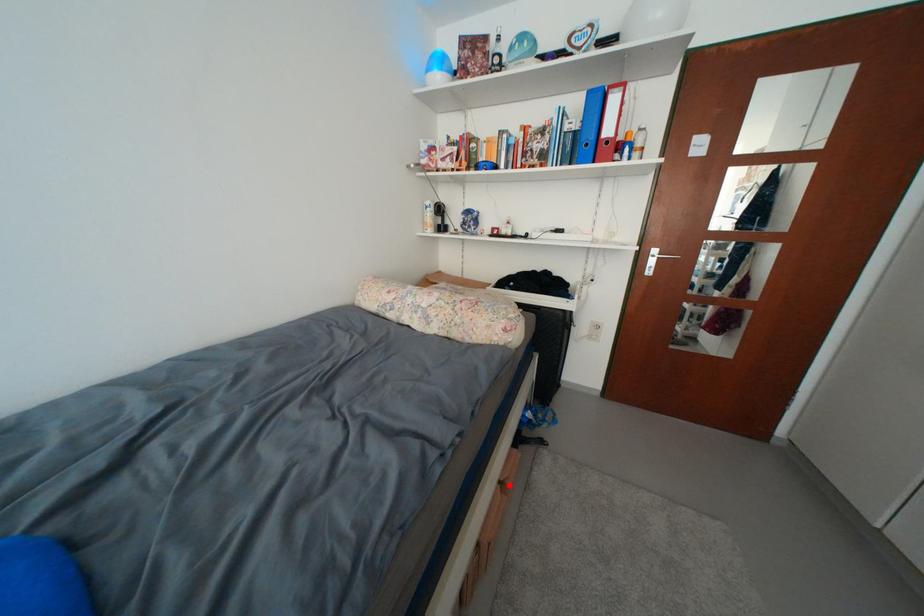
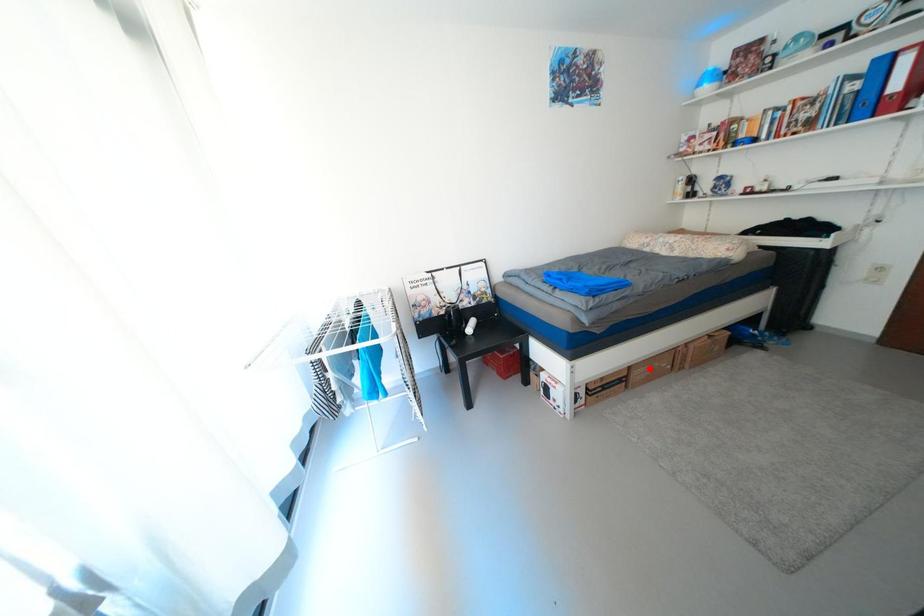
From the picture: I am providing you with two images of the same scene from different viewpoints. A red point is marked on the first image and another point is marked on the second image. Are the points marked in image1 and image2 representing the same 3D position?

No